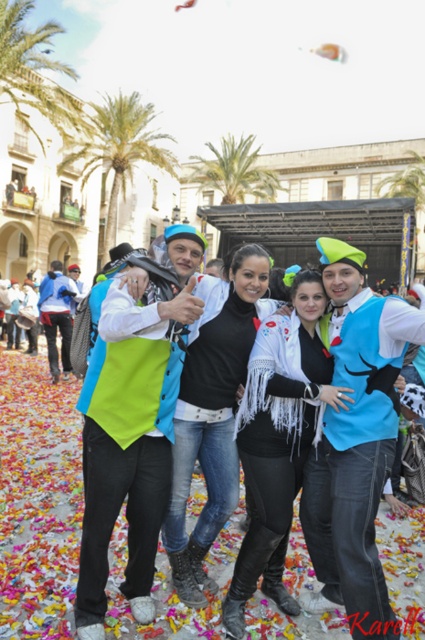
Between green leafy palm tree at upper left and green leafy palm tree at center, which one has more height?

Standing taller between the two is green leafy palm tree at upper left.

Between green leafy palm tree at upper left and green leafy palm tree at center, which one has less height?

With less height is green leafy palm tree at center.

Identify the location of green leafy palm tree at upper left. The image size is (425, 640). (119, 150).

The width and height of the screenshot is (425, 640). What are the coordinates of `green leafy palm tree at upper left` in the screenshot? It's located at (119, 150).

Does blue felt vest at center lie in front of green leafy palm tree at center?

Yes, blue felt vest at center is closer to the viewer.

Between blue felt vest at center and green leafy palm tree at center, which one is positioned lower?

Positioned lower is blue felt vest at center.

Is point (354, 536) farther from camera compared to point (234, 147)?

No, (354, 536) is in front of (234, 147).

Image resolution: width=425 pixels, height=640 pixels. What are the coordinates of `blue felt vest at center` in the screenshot? It's located at (360, 456).

Who is shorter, black matte jacket at center or green leafy palm tree at center?

Standing shorter between the two is black matte jacket at center.

Can you confirm if black matte jacket at center is positioned above green leafy palm tree at center?

Actually, black matte jacket at center is below green leafy palm tree at center.

Does point (189, 554) come closer to viewer compared to point (224, 186)?

Yes, point (189, 554) is in front of point (224, 186).

This screenshot has width=425, height=640. I want to click on black matte jacket at center, so click(x=212, y=420).